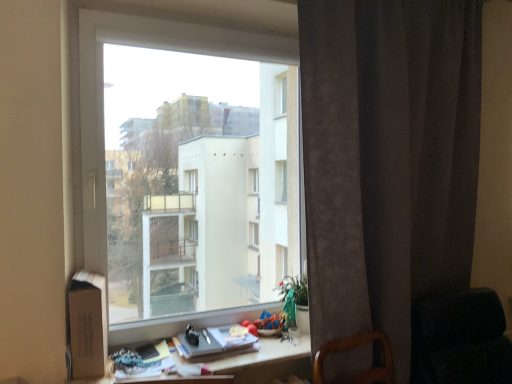
I want to click on free point above matte gray book at lower center (from a real-world perspective), so click(218, 336).